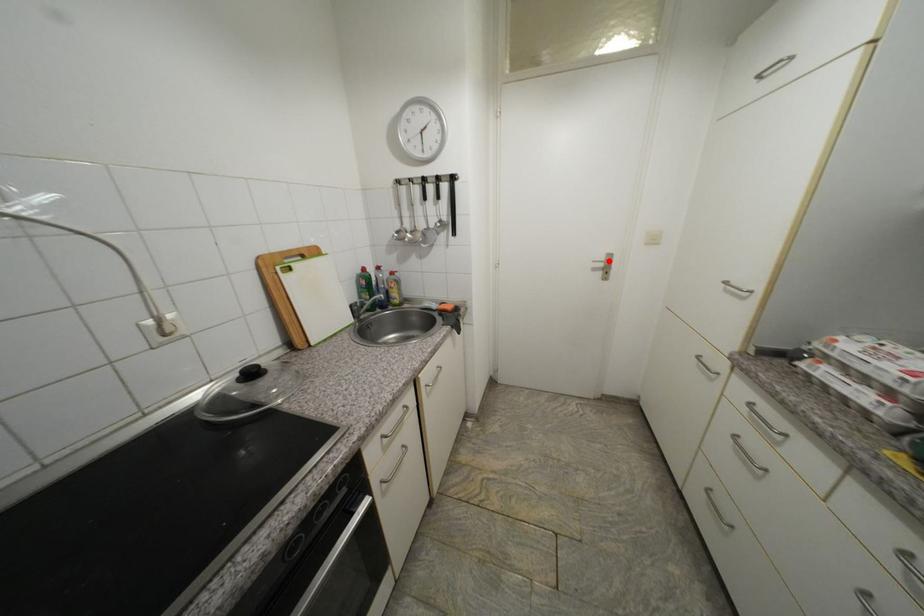
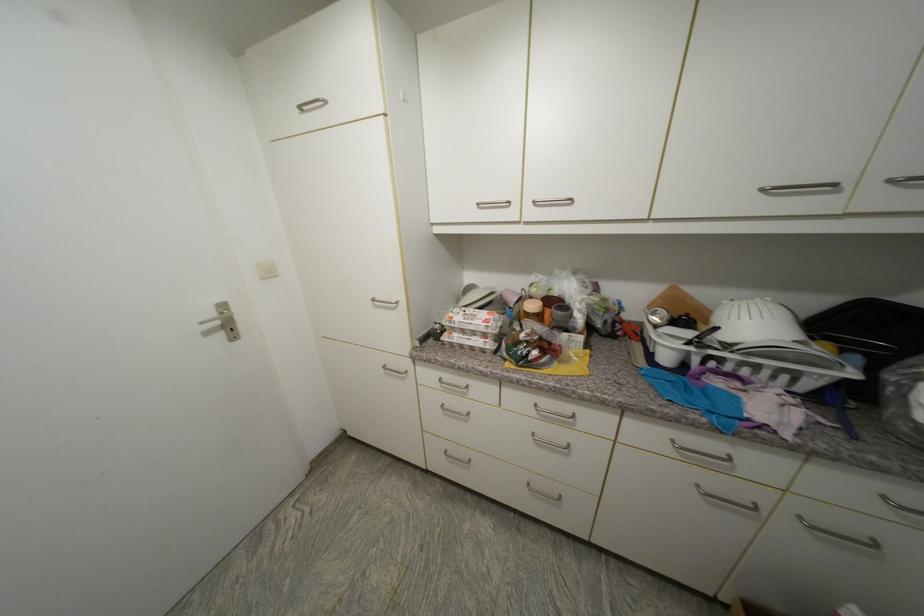
The point at the highlighted location is marked in the first image. Where is the corresponding point in the second image?

(220, 315)